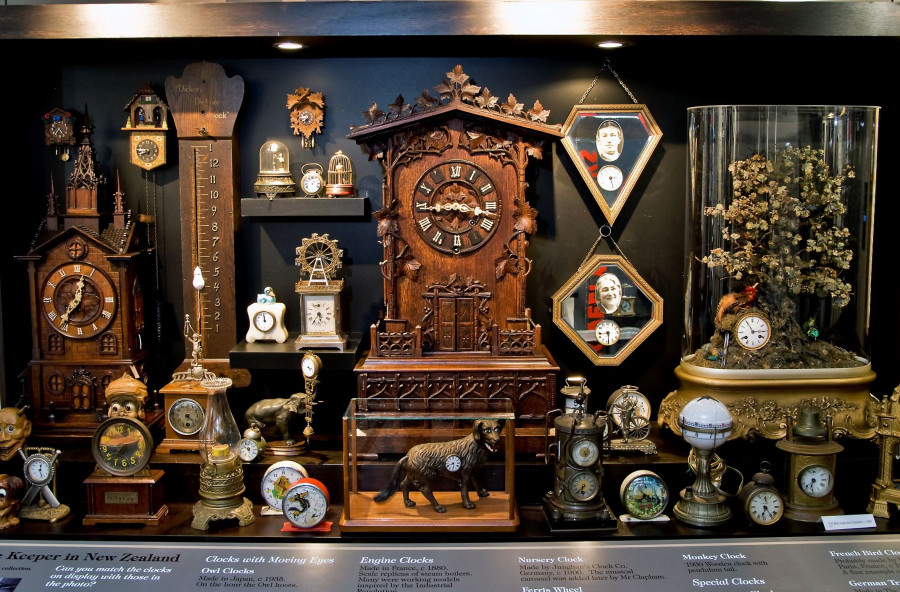
The width and height of the screenshot is (900, 592). In order to click on wooden cuckoo clocks in this screenshot , I will do `click(148, 147)`, `click(304, 118)`, `click(59, 125)`, `click(93, 284)`, `click(455, 262)`.